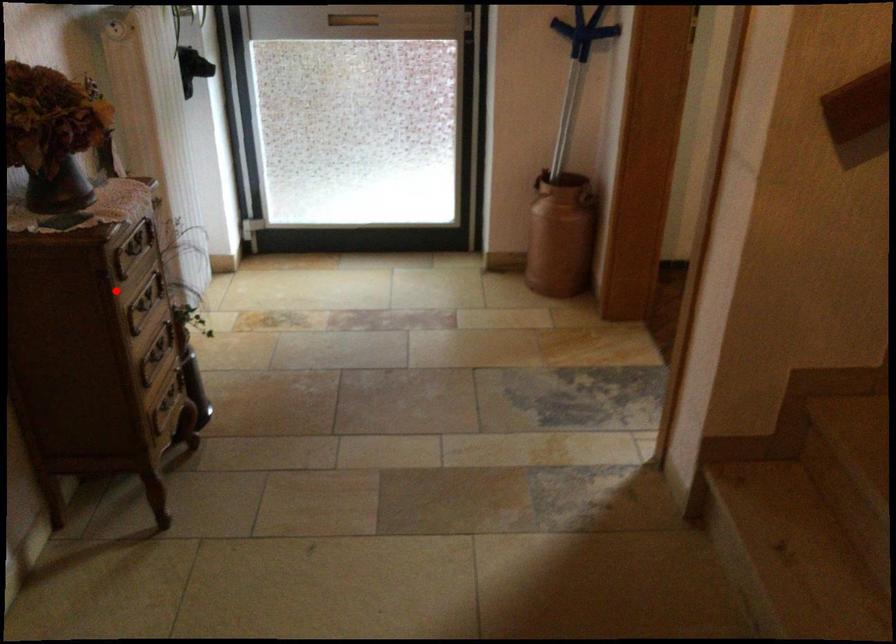
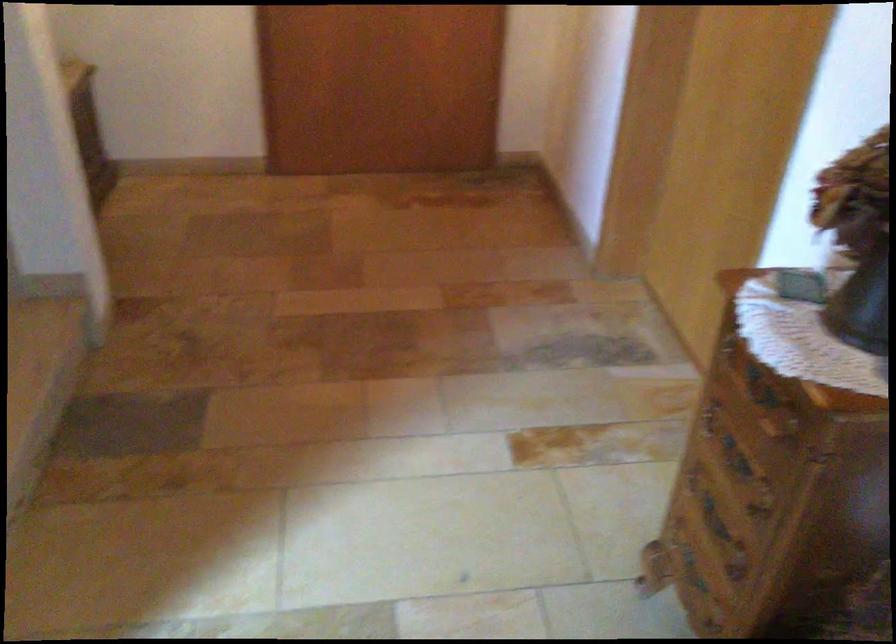
Question: I am providing you with two images of the same scene from different viewpoints. A red point is shown in image1. For the corresponding object point in image2, is it positioned nearer or farther from the camera?

Choices:
 (A) Nearer
 (B) Farther

Answer: (A)